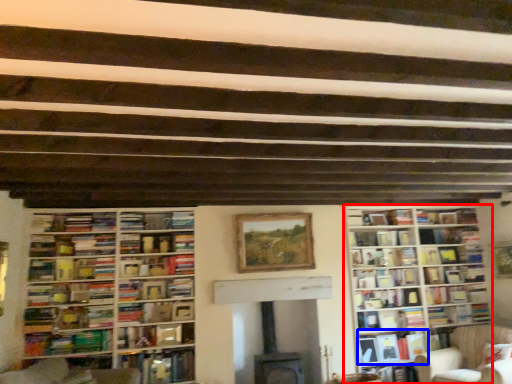
Question: Which object appears farthest to the camera in this image, bookcase (highlighted by a red box) or book (highlighted by a blue box)?

Choices:
 (A) bookcase
 (B) book

Answer: (B)